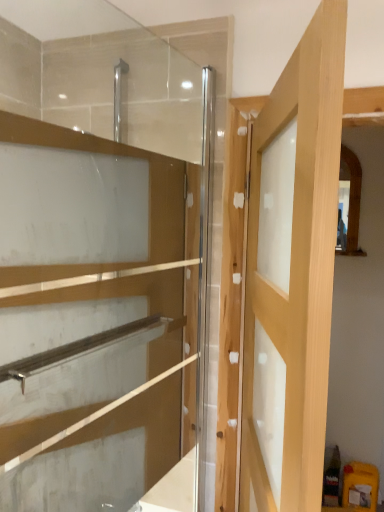
Question: From the image's perspective, does transparent glass cabinet at upper left appear higher than light wood door at center?

Choices:
 (A) no
 (B) yes

Answer: (B)

Question: Is transparent glass cabinet at upper left bigger than light wood door at center?

Choices:
 (A) no
 (B) yes

Answer: (A)

Question: Is transparent glass cabinet at upper left positioned in front of light wood door at center?

Choices:
 (A) no
 (B) yes

Answer: (A)

Question: From the image's perspective, does transparent glass cabinet at upper left appear lower than light wood door at center?

Choices:
 (A) no
 (B) yes

Answer: (A)

Question: Are transparent glass cabinet at upper left and light wood door at center far apart?

Choices:
 (A) yes
 (B) no

Answer: (B)

Question: Is transparent glass cabinet at upper left taller than light wood door at center?

Choices:
 (A) no
 (B) yes

Answer: (B)

Question: Is light wood door at center taller than transparent glass cabinet at upper left?

Choices:
 (A) yes
 (B) no

Answer: (B)

Question: Considering the relative sizes of light wood door at center and transparent glass cabinet at upper left in the image provided, is light wood door at center smaller than transparent glass cabinet at upper left?

Choices:
 (A) yes
 (B) no

Answer: (B)

Question: Does light wood door at center have a lesser height compared to transparent glass cabinet at upper left?

Choices:
 (A) yes
 (B) no

Answer: (A)

Question: From the image's perspective, would you say light wood door at center is positioned over transparent glass cabinet at upper left?

Choices:
 (A) no
 (B) yes

Answer: (A)

Question: Can you confirm if light wood door at center is positioned to the left of transparent glass cabinet at upper left?

Choices:
 (A) no
 (B) yes

Answer: (A)

Question: Is the position of light wood door at center less distant than that of transparent glass cabinet at upper left?

Choices:
 (A) no
 (B) yes

Answer: (B)

Question: Does point (331, 218) appear closer or farther from the camera than point (129, 162)?

Choices:
 (A) closer
 (B) farther

Answer: (A)